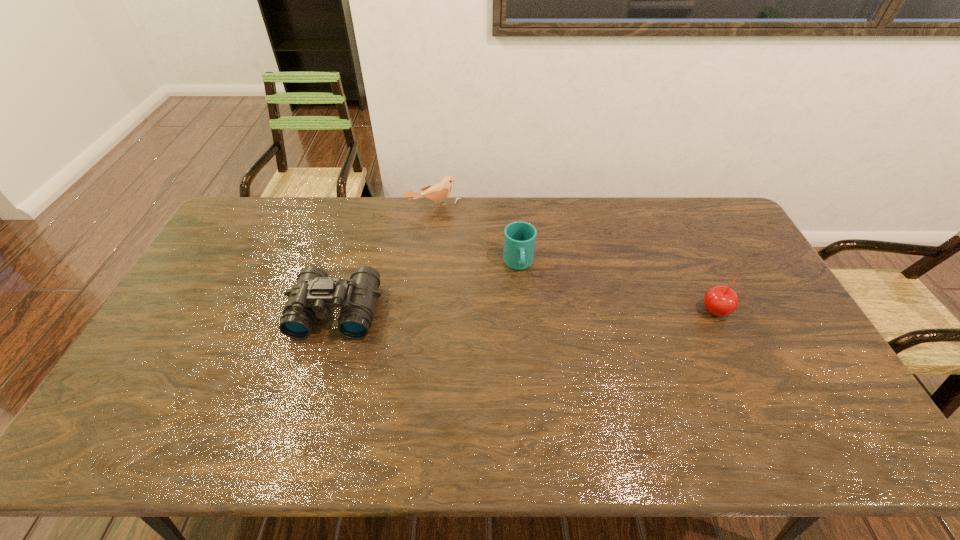
Find the location of a particular element. vacant space that's between the second object from left to right and the rightmost object is located at coordinates (574, 259).

The width and height of the screenshot is (960, 540). What are the coordinates of `free point between the second object from left to right and the second farthest object` in the screenshot? It's located at (476, 235).

The width and height of the screenshot is (960, 540). What are the coordinates of `free space that is in between the bird and the binoculars` in the screenshot? It's located at (385, 259).

Where is `vacant point located between the rightmost object and the third object from left to right`? Image resolution: width=960 pixels, height=540 pixels. vacant point located between the rightmost object and the third object from left to right is located at coordinates (616, 288).

Find the location of a particular element. vacant region between the cup and the third object from right to left is located at coordinates (476, 235).

At what (x,y) coordinates should I click in order to perform the action: click on vacant area that lies between the binoculars and the third object from left to right. Please return your answer as a coordinate pair (x, y). Looking at the image, I should click on (427, 287).

Locate an element on the screen. unoccupied position between the farthest object and the leftmost object is located at coordinates (385, 259).

At what (x,y) coordinates should I click in order to perform the action: click on vacant area that lies between the second farthest object and the leftmost object. Please return your answer as a coordinate pair (x, y). Image resolution: width=960 pixels, height=540 pixels. Looking at the image, I should click on (427, 287).

In order to click on vacant area that lies between the cup and the rightmost object in this screenshot , I will do `click(616, 288)`.

This screenshot has width=960, height=540. What are the coordinates of `blank region between the cherry and the binoculars` in the screenshot? It's located at (525, 311).